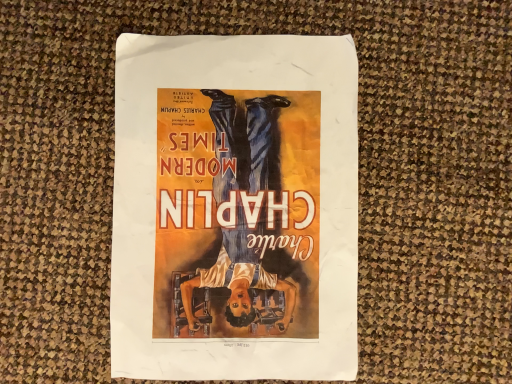
Locate an element on the screen. The height and width of the screenshot is (384, 512). free spot above matte paper poster at center (from a real-world perspective) is located at coordinates (232, 215).